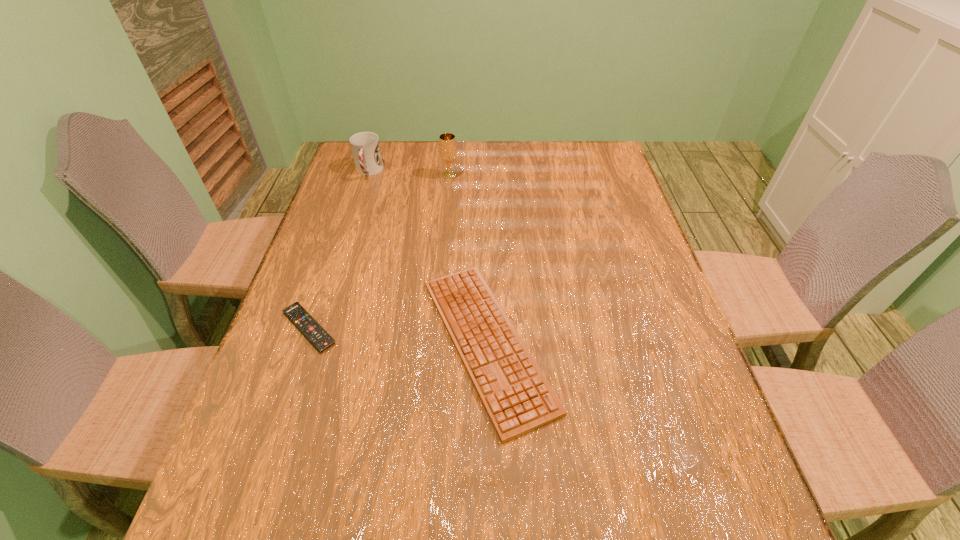
Locate which object ranks second in proximity to the remote control. Please provide its 2D coordinates. Your answer should be formatted as a tuple, i.e. [(x, y)], where the tuple contains the x and y coordinates of a point satisfying the conditions above.

[(365, 146)]

You are a GUI agent. You are given a task and a screenshot of the screen. Output one action in this format:
    pyautogui.click(x=<x>, y=<y>)
    Task: Click on the vacant space that satisfies the following two spatial constraints: 1. on the side of the tallest object where the handle is located; 2. on the left side of the second tallest object
    This screenshot has width=960, height=540.
    Given the screenshot: What is the action you would take?
    pyautogui.click(x=368, y=176)

You are a GUI agent. You are given a task and a screenshot of the screen. Output one action in this format:
    pyautogui.click(x=<x>, y=<y>)
    Task: Click on the vacant space that satisfies the following two spatial constraints: 1. on the side of the chalice where the handle is located; 2. on the left side of the third shortest object
    
    Given the screenshot: What is the action you would take?
    pyautogui.click(x=368, y=176)

This screenshot has height=540, width=960. Find the location of `free space that satisfies the following two spatial constraints: 1. on the side of the cup where the handle is located; 2. on the right side of the chalice`. free space that satisfies the following two spatial constraints: 1. on the side of the cup where the handle is located; 2. on the right side of the chalice is located at coordinates (368, 176).

You are a GUI agent. You are given a task and a screenshot of the screen. Output one action in this format:
    pyautogui.click(x=<x>, y=<y>)
    Task: Click on the free space in the image that satisfies the following two spatial constraints: 1. on the side of the second tallest object where the handle is located; 2. on the right side of the computer keyboard
    
    Given the screenshot: What is the action you would take?
    pyautogui.click(x=314, y=343)